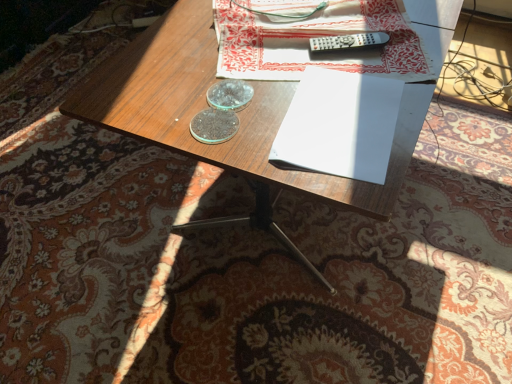
Where is `vacant space in white paper at center (from a real-world perspective)`? Image resolution: width=512 pixels, height=384 pixels. vacant space in white paper at center (from a real-world perspective) is located at coordinates (341, 120).